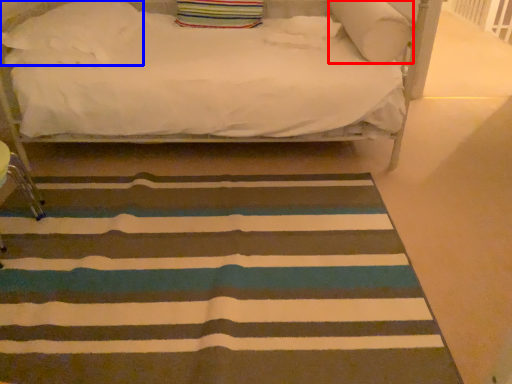
Question: Which object appears closest to the camera in this image, pillow (highlighted by a red box) or pillow (highlighted by a blue box)?

Choices:
 (A) pillow
 (B) pillow

Answer: (A)